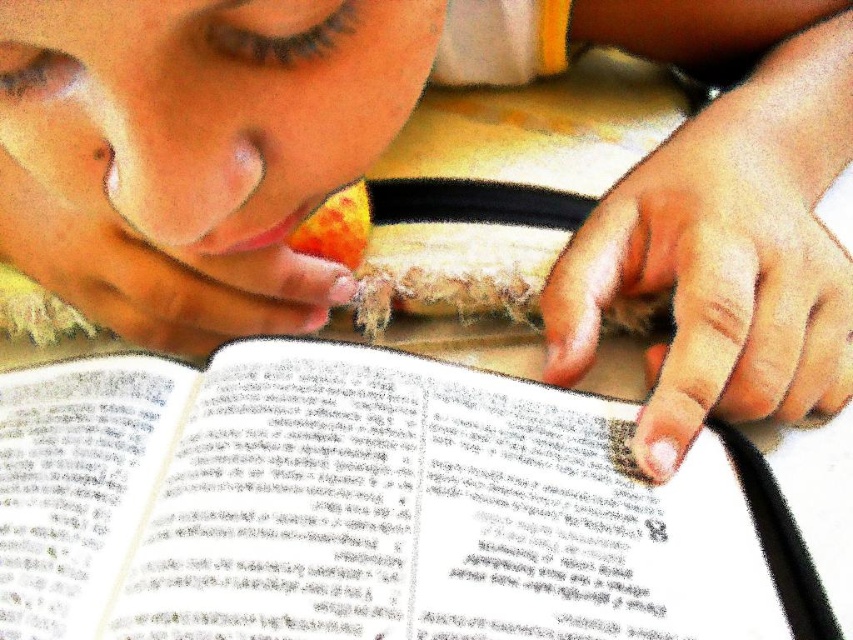
You are taking a photo of the book in the scene. The book has two points marked on its pages at coordinates point (738, 291) and point (79, 291). If you want to focus on the point closer to the camera, which coordinate should you adjust your camera to focus on?

Point (738, 291) is closer to the camera than point (79, 291), so you should focus on point (738, 291).

You are holding a ruler and want to measure the distance from your eyes to the white paper book at center. Based on the image, what is the approximate distance in inches?

The distance between the white paper book at center and the viewer is 12.13 inches, so the approximate distance from your eyes to the white paper book at center is 12.13 inches.

You are a photographer trying to capture the white paper book at center and the smooth skin hand at lower right in focus. Which object should you focus on first to ensure both are sharp in the photo?

You should focus on the white paper book at center first since it is closer to the viewer than the smooth skin hand at lower right, allowing the hand to fall into the depth of field when focusing on the closer object.